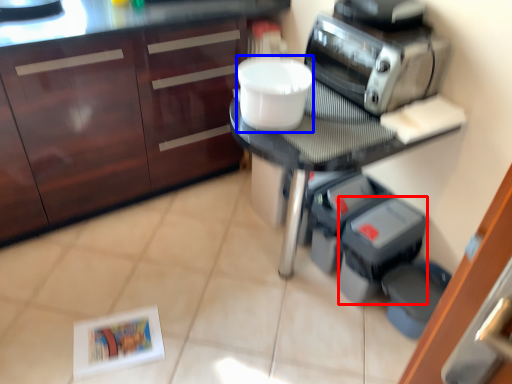
Question: Which point is closer to the camera, appliance (highlighted by a red box) or toilet bowl (highlighted by a blue box)?

Choices:
 (A) appliance
 (B) toilet bowl

Answer: (B)